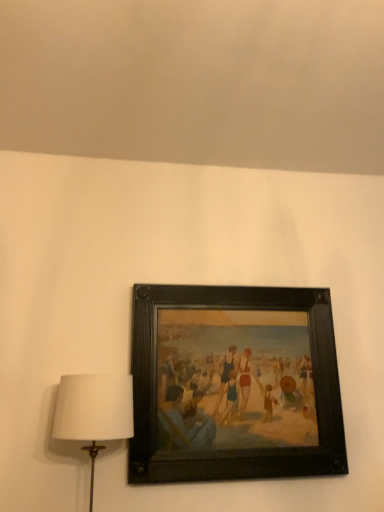
Question: Is white fabric lampshade at left wider or thinner than wooden picture frame at center?

Choices:
 (A) thin
 (B) wide

Answer: (B)

Question: In terms of size, does white fabric lampshade at left appear bigger or smaller than wooden picture frame at center?

Choices:
 (A) small
 (B) big

Answer: (A)

Question: From the image's perspective, is white fabric lampshade at left located above or below wooden picture frame at center?

Choices:
 (A) above
 (B) below

Answer: (B)

Question: In terms of height, does wooden picture frame at center look taller or shorter compared to white fabric lampshade at left?

Choices:
 (A) short
 (B) tall

Answer: (B)

Question: Is wooden picture frame at center bigger or smaller than white fabric lampshade at left?

Choices:
 (A) big
 (B) small

Answer: (A)

Question: Visually, is wooden picture frame at center positioned to the left or to the right of white fabric lampshade at left?

Choices:
 (A) right
 (B) left

Answer: (A)

Question: From a real-world perspective, is wooden picture frame at center positioned above or below white fabric lampshade at left?

Choices:
 (A) above
 (B) below

Answer: (A)